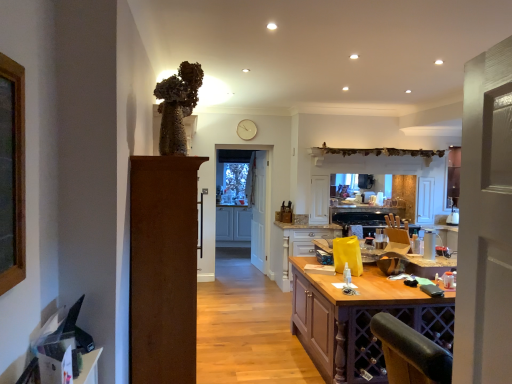
I want to click on free spot in front of clear glass door at center, so click(x=243, y=279).